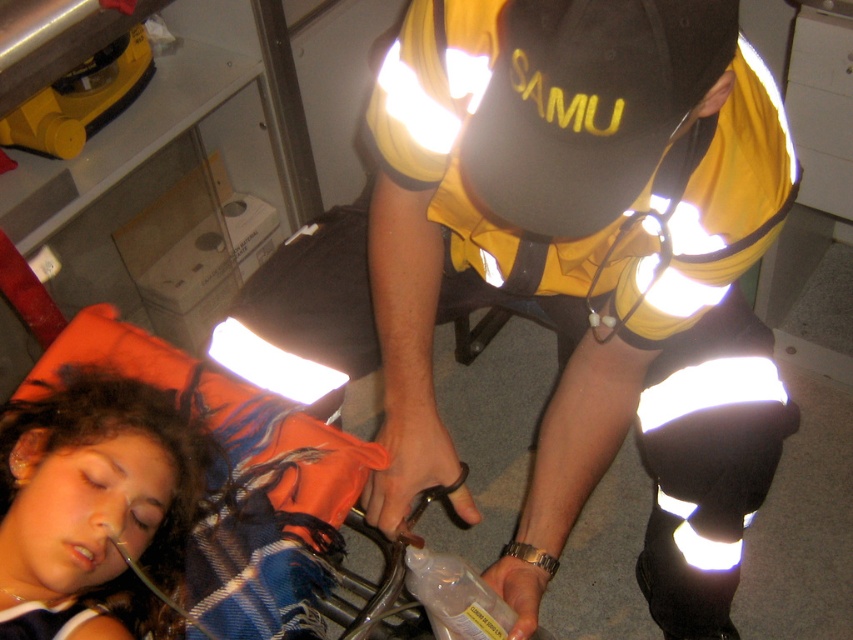
Question: Is reflective yellow vest at center bigger than orange fabric pillow at lower left?

Choices:
 (A) no
 (B) yes

Answer: (B)

Question: Which point is farther from the camera taking this photo?

Choices:
 (A) (563, 234)
 (B) (181, 474)

Answer: (B)

Question: Can you confirm if reflective yellow vest at center is positioned to the left of orange fabric pillow at lower left?

Choices:
 (A) yes
 (B) no

Answer: (B)

Question: Is reflective yellow vest at center further to camera compared to orange fabric pillow at lower left?

Choices:
 (A) yes
 (B) no

Answer: (B)